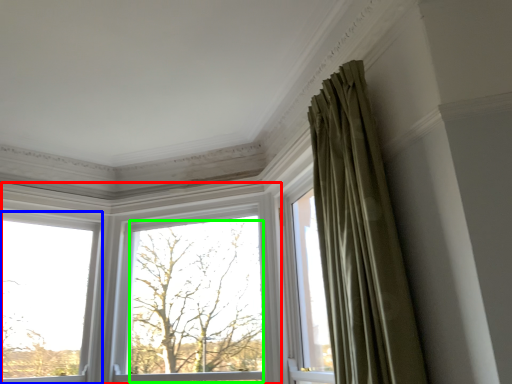
Question: Which is farther away from window (highlighted by a red box)? window (highlighted by a blue box) or tree (highlighted by a green box)?

Choices:
 (A) window
 (B) tree

Answer: (A)